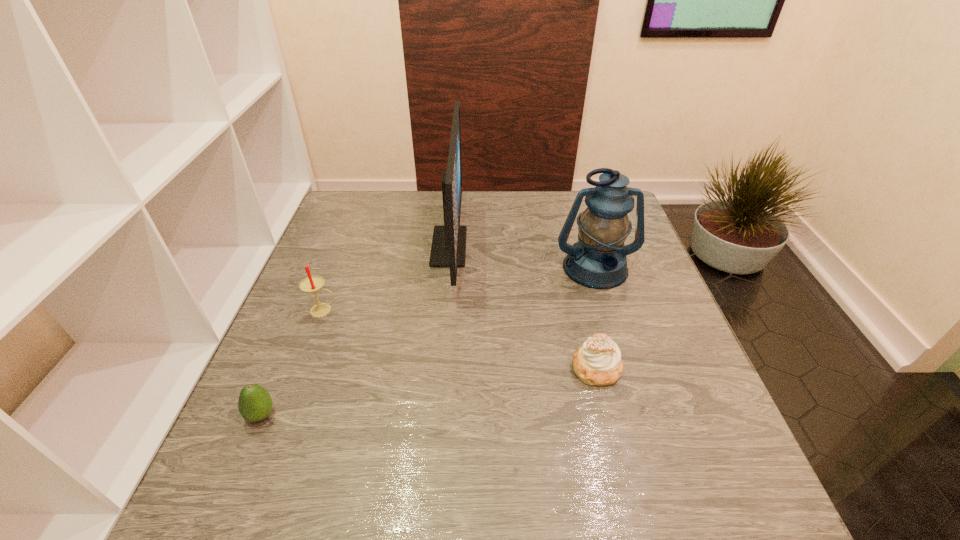
At what (x,y) coordinates should I click in order to perform the action: click on object that is at the far edge. Please return your answer as a coordinate pair (x, y). The height and width of the screenshot is (540, 960). Looking at the image, I should click on (448, 249).

Where is `candle positioned at the left edge`? Image resolution: width=960 pixels, height=540 pixels. candle positioned at the left edge is located at coordinates (310, 284).

What are the coordinates of `avocado that is at the left edge` in the screenshot? It's located at (255, 404).

At what (x,y) coordinates should I click in order to perform the action: click on lantern present at the right edge. Please return your answer as a coordinate pair (x, y). This screenshot has height=540, width=960. Looking at the image, I should click on (598, 260).

Identify the location of pastry situated at the right edge. The height and width of the screenshot is (540, 960). (597, 362).

Where is `free space at the far edge of the desktop`? Image resolution: width=960 pixels, height=540 pixels. free space at the far edge of the desktop is located at coordinates (524, 221).

Where is `free region at the near edge`? The height and width of the screenshot is (540, 960). free region at the near edge is located at coordinates (445, 496).

This screenshot has width=960, height=540. In the image, there is a desktop. Find the location of `free space at the left edge`. free space at the left edge is located at coordinates (350, 285).

Locate an element on the screen. The image size is (960, 540). free space at the right edge is located at coordinates (682, 341).

This screenshot has height=540, width=960. What are the coordinates of `blank area at the far left corner` in the screenshot? It's located at (389, 192).